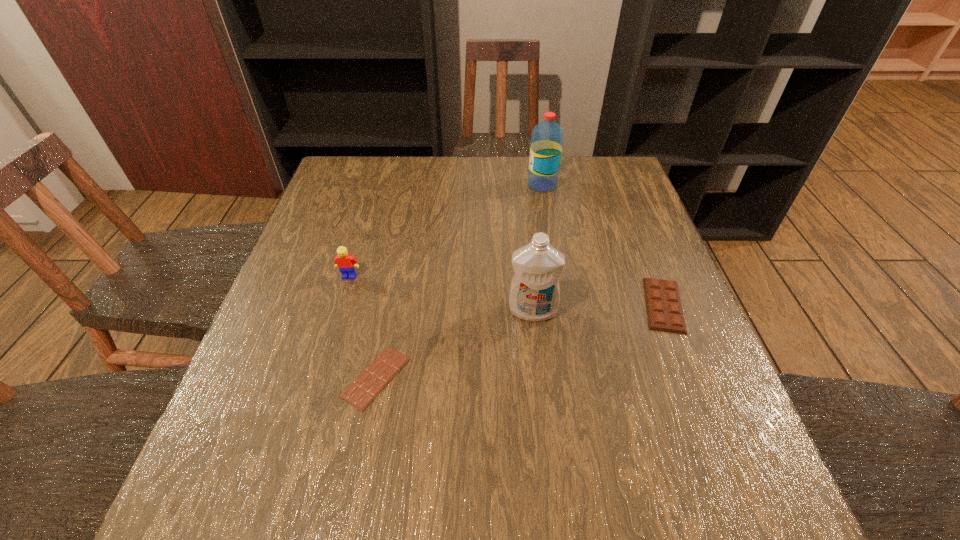
This screenshot has width=960, height=540. I want to click on the farthest object, so click(x=547, y=137).

The height and width of the screenshot is (540, 960). I want to click on detergent, so click(x=534, y=296).

This screenshot has width=960, height=540. Identify the location of the third shortest object. (346, 263).

Where is `Lego`? The height and width of the screenshot is (540, 960). Lego is located at coordinates pyautogui.click(x=346, y=263).

I want to click on the taller chocolate bar, so click(664, 310).

At what (x,y) coordinates should I click in order to perform the action: click on the rightmost object. Please return your answer as a coordinate pair (x, y). The height and width of the screenshot is (540, 960). Looking at the image, I should click on [664, 310].

This screenshot has height=540, width=960. In order to click on the nearer chocolate bar in this screenshot , I will do `click(364, 389)`.

Where is `the left chocolate bar`? The height and width of the screenshot is (540, 960). the left chocolate bar is located at coordinates (364, 389).

Locate an element on the screen. Image resolution: width=960 pixels, height=540 pixels. free region located 0.060m on the front label of the water bottle is located at coordinates (507, 185).

Where is `vacant region located on the front label of the water bottle`? vacant region located on the front label of the water bottle is located at coordinates (450, 185).